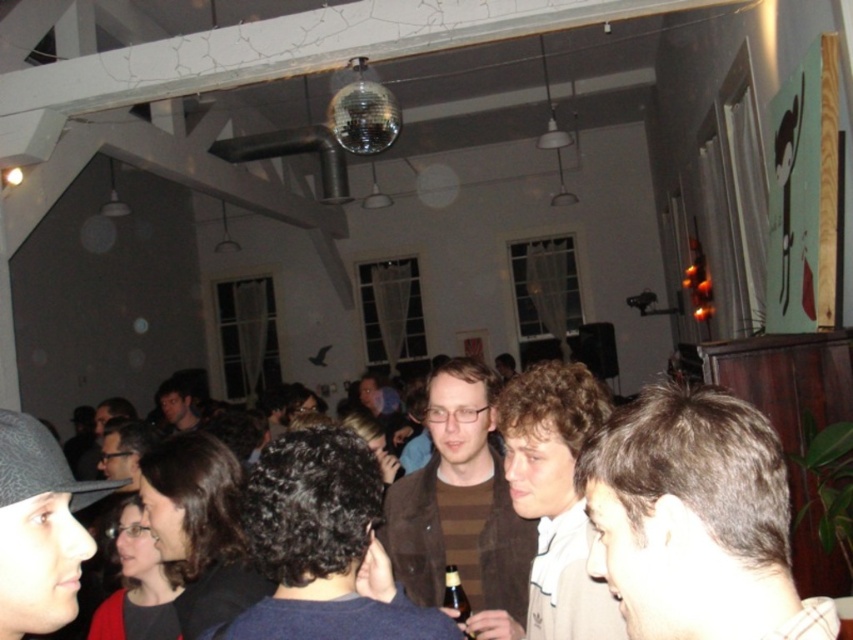
Question: Can you confirm if brown hair at center is wider than matte brown hair at center?

Choices:
 (A) yes
 (B) no

Answer: (B)

Question: Is brown wool sweater at center above brown matte sweater at center?

Choices:
 (A) no
 (B) yes

Answer: (B)

Question: Is matte black hat at lower left above brown glass bottle at center?

Choices:
 (A) no
 (B) yes

Answer: (B)

Question: Based on their relative distances, which object is nearer to the brown glass bottle at center?

Choices:
 (A) brown textured sweater at center
 (B) brown matte sweater at center
 (C) matte brown hair at center

Answer: (B)

Question: Which of the following is the farthest from the observer?

Choices:
 (A) brown hair at center
 (B) brown textured sweater at center

Answer: (B)

Question: Among these points, which one is nearest to the camera?

Choices:
 (A) (456, 595)
 (B) (355, 442)
 (C) (567, 442)

Answer: (B)